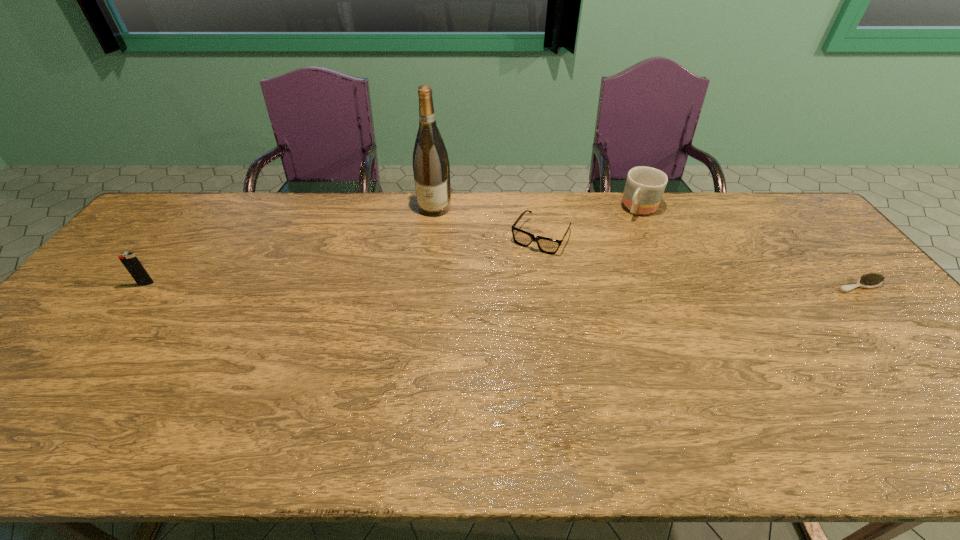
The width and height of the screenshot is (960, 540). Find the location of `vacant space that is in between the rightmost object and the wine bottle`. vacant space that is in between the rightmost object and the wine bottle is located at coordinates (647, 247).

At what (x,y) coordinates should I click in order to perform the action: click on free spot between the mug and the rightmost object. Please return your answer as a coordinate pair (x, y). The height and width of the screenshot is (540, 960). Looking at the image, I should click on (750, 247).

The width and height of the screenshot is (960, 540). Find the location of `vacant space in between the second shortest object and the igniter`. vacant space in between the second shortest object and the igniter is located at coordinates (344, 260).

Identify the location of vacant area that lies between the mug and the second object from left to right. (538, 208).

In order to click on free area in between the tallest object and the rightmost object in this screenshot , I will do `click(647, 247)`.

The image size is (960, 540). Identify the location of free spot between the leftmost object and the wine bottle. (291, 246).

Image resolution: width=960 pixels, height=540 pixels. What are the coordinates of `empty location between the second object from right to left and the rightmost object` in the screenshot? It's located at (750, 247).

Where is `unoccupied area between the scrubbing brush and the igniter`? unoccupied area between the scrubbing brush and the igniter is located at coordinates (503, 285).

This screenshot has height=540, width=960. I want to click on free space between the igniter and the mug, so click(x=394, y=247).

Point out which object is positioned as the nearest to the scrubbing brush. Please provide its 2D coordinates. Your answer should be formatted as a tuple, i.e. [(x, y)], where the tuple contains the x and y coordinates of a point satisfying the conditions above.

[(644, 187)]